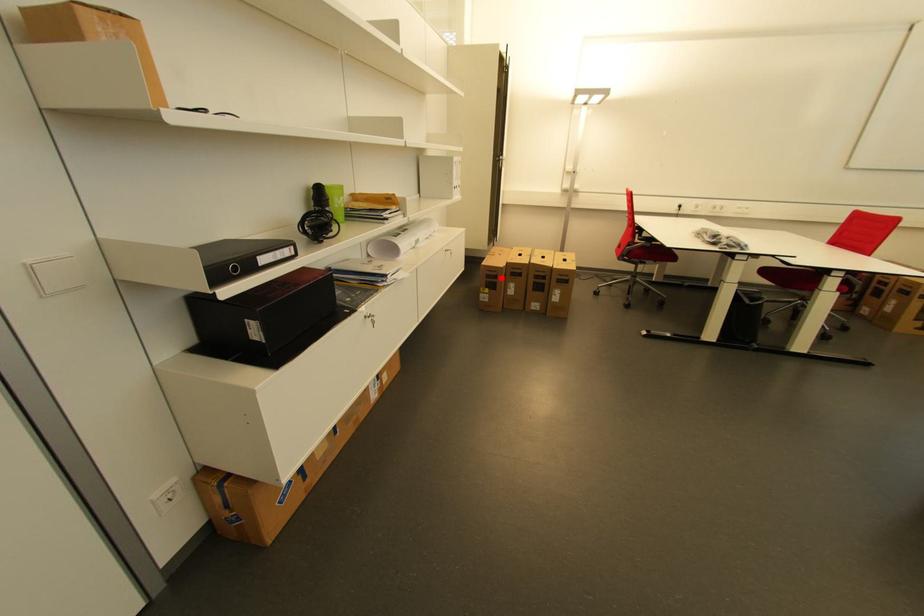
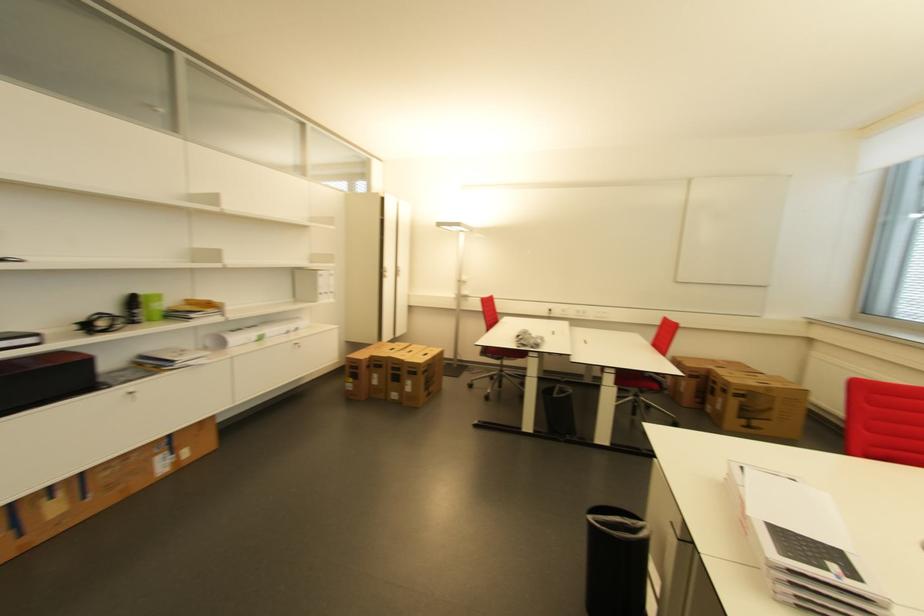
Where in the second image is the point corresponding to the highlighted location from the first image?

(362, 369)